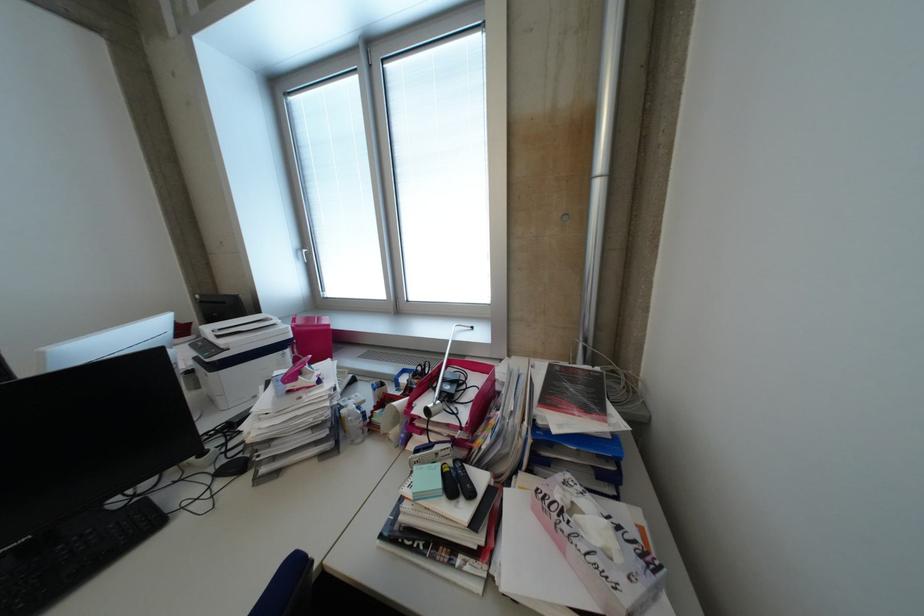
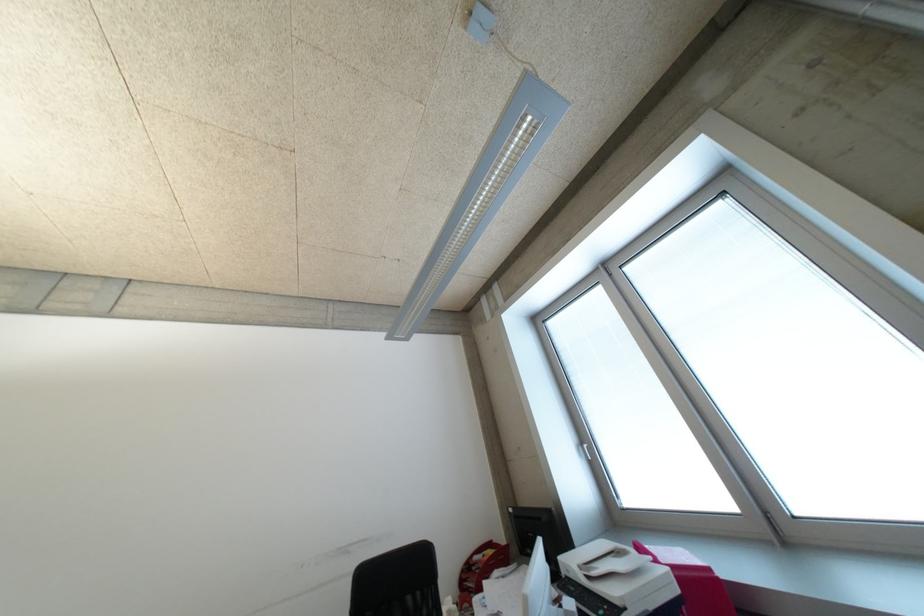
Where in the second image is the point corresponding to point 299,337 from the first image?

(687, 591)